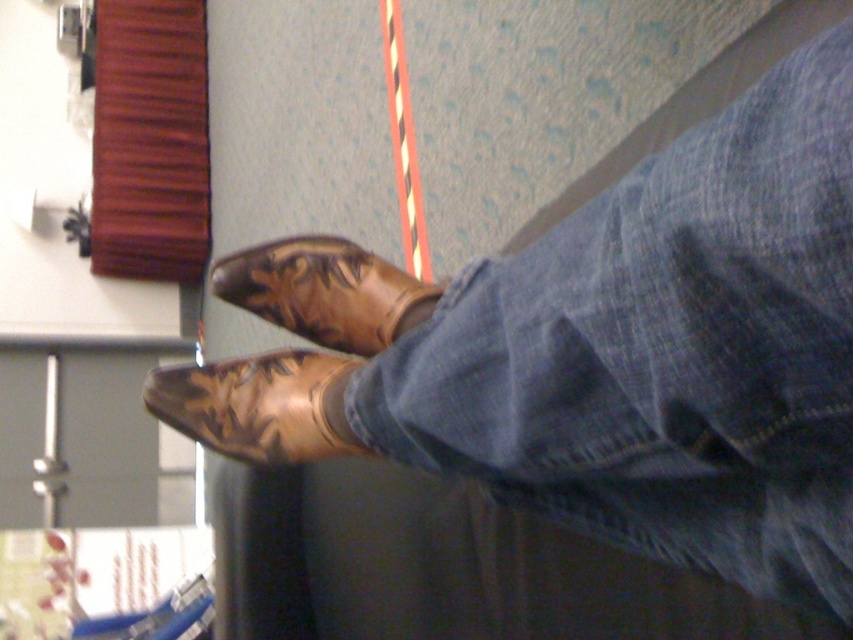
Between denim at lower right and brown leather boot at center, which one appears on the right side from the viewer's perspective?

Positioned to the right is denim at lower right.

Who is more distant from viewer, (x=602, y=291) or (x=219, y=282)?

Point (x=219, y=282)

Image resolution: width=853 pixels, height=640 pixels. Identify the location of denim at lower right. (666, 353).

Can you confirm if shiny brown leather boot at lower center is positioned below brown leather boot at center?

Yes, shiny brown leather boot at lower center is below brown leather boot at center.

Between shiny brown leather boot at lower center and brown leather boot at center, which one has less height?

With less height is shiny brown leather boot at lower center.

Find the location of a particular element. This screenshot has height=640, width=853. shiny brown leather boot at lower center is located at coordinates (256, 404).

Which is below, denim at lower right or shiny brown leather boot at lower center?

denim at lower right

Is denim at lower right positioned behind shiny brown leather boot at lower center?

No.

Where is `denim at lower right`? denim at lower right is located at coordinates (666, 353).